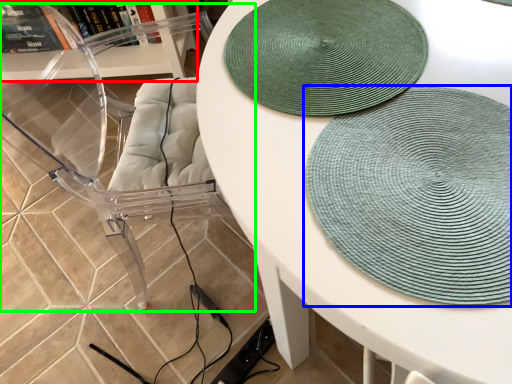
Question: Estimate the real-world distances between objects in this image. Which object is farther from shelf (highlighted by a red box), mat (highlighted by a blue box) or swivel chair (highlighted by a green box)?

Choices:
 (A) mat
 (B) swivel chair

Answer: (A)